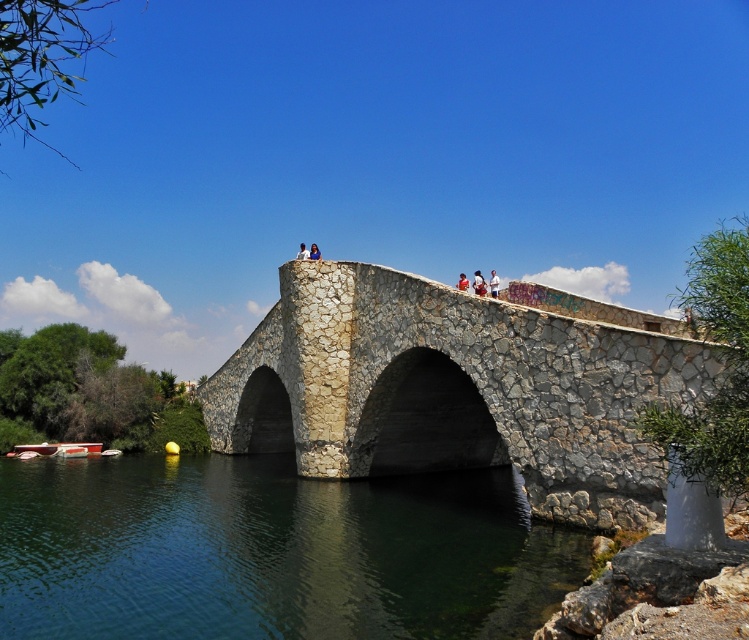
Question: Among these points, which one is nearest to the camera?

Choices:
 (A) (457, 282)
 (B) (28, 448)
 (C) (266, 356)
 (D) (482, 602)

Answer: (D)

Question: Can you confirm if green stone river at lower center is smaller than light blue fabric shirt at center?

Choices:
 (A) no
 (B) yes

Answer: (B)

Question: Can you confirm if white plastic boat at lower left is bigger than blue stone figure at center?

Choices:
 (A) no
 (B) yes

Answer: (A)

Question: Which point is farther from the camera taking this photo?

Choices:
 (A) (297, 257)
 (B) (463, 285)

Answer: (A)

Question: Estimate the real-world distances between objects in this image. Which object is closer to the stone textured bridge at center?

Choices:
 (A) blue stone figure at center
 (B) light blue fabric shirt at center
 (C) light blue stone person at center

Answer: (B)

Question: Considering the relative positions of green stone river at lower center and light blue stone person at center in the image provided, where is green stone river at lower center located with respect to light blue stone person at center?

Choices:
 (A) above
 (B) below

Answer: (B)